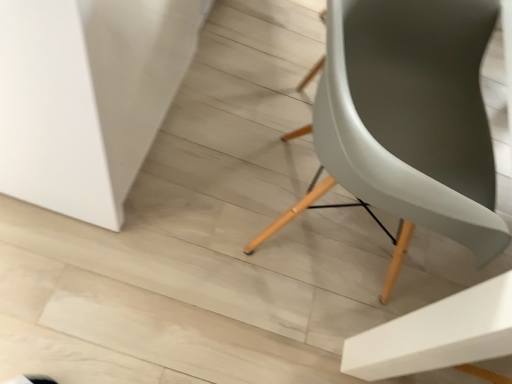
Locate an element on the screen. This screenshot has height=384, width=512. free space in front of matte gray chair at center is located at coordinates (205, 329).